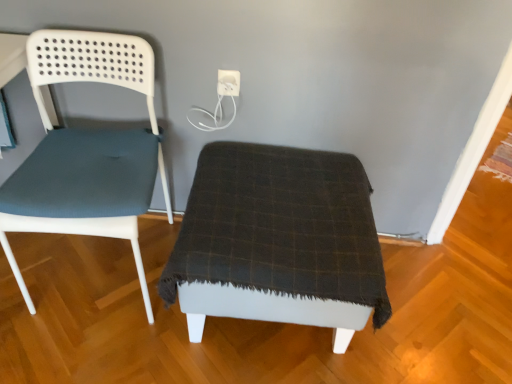
Question: Is dark plaid fabric ottoman at center positioned beyond the bounds of white plastic electric outlet at upper center?

Choices:
 (A) no
 (B) yes

Answer: (B)

Question: Are dark plaid fabric ottoman at center and white plastic electric outlet at upper center located far from each other?

Choices:
 (A) yes
 (B) no

Answer: (B)

Question: Considering the relative positions of dark plaid fabric ottoman at center and white plastic electric outlet at upper center in the image provided, is dark plaid fabric ottoman at center to the left of white plastic electric outlet at upper center from the viewer's perspective?

Choices:
 (A) yes
 (B) no

Answer: (B)

Question: Does dark plaid fabric ottoman at center lie in front of white plastic electric outlet at upper center?

Choices:
 (A) yes
 (B) no

Answer: (A)

Question: Considering the relative sizes of dark plaid fabric ottoman at center and white plastic electric outlet at upper center in the image provided, is dark plaid fabric ottoman at center smaller than white plastic electric outlet at upper center?

Choices:
 (A) no
 (B) yes

Answer: (A)

Question: Does dark plaid fabric ottoman at center appear on the right side of white plastic electric outlet at upper center?

Choices:
 (A) no
 (B) yes

Answer: (B)

Question: Considering the relative sizes of white plastic electric outlet at upper center and matte blue fabric chair at left in the image provided, is white plastic electric outlet at upper center bigger than matte blue fabric chair at left?

Choices:
 (A) no
 (B) yes

Answer: (A)

Question: From a real-world perspective, is white plastic electric outlet at upper center positioned over matte blue fabric chair at left based on gravity?

Choices:
 (A) no
 (B) yes

Answer: (B)

Question: From the image's perspective, is white plastic electric outlet at upper center located above matte blue fabric chair at left?

Choices:
 (A) no
 (B) yes

Answer: (B)

Question: Can you confirm if white plastic electric outlet at upper center is thinner than matte blue fabric chair at left?

Choices:
 (A) no
 (B) yes

Answer: (B)

Question: Can we say white plastic electric outlet at upper center lies outside matte blue fabric chair at left?

Choices:
 (A) yes
 (B) no

Answer: (A)

Question: Can you confirm if white plastic electric outlet at upper center is shorter than matte blue fabric chair at left?

Choices:
 (A) yes
 (B) no

Answer: (A)

Question: Is dark plaid fabric ottoman at center taller than matte blue fabric chair at left?

Choices:
 (A) no
 (B) yes

Answer: (A)